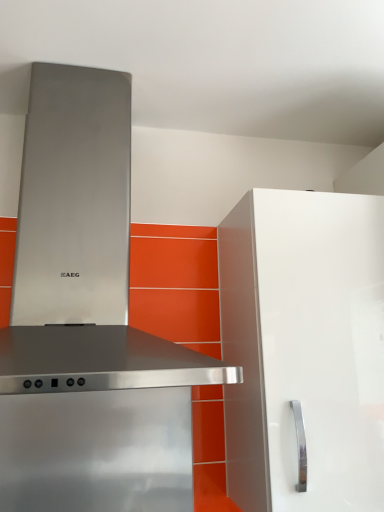
Question: Could you tell me if stainless steel range hood at upper left is facing white glossy cabinet at right?

Choices:
 (A) no
 (B) yes

Answer: (A)

Question: Is there a large distance between stainless steel range hood at upper left and white glossy cabinet at right?

Choices:
 (A) no
 (B) yes

Answer: (A)

Question: Is stainless steel range hood at upper left facing away from white glossy cabinet at right?

Choices:
 (A) no
 (B) yes

Answer: (A)

Question: Is the position of stainless steel range hood at upper left less distant than that of white glossy cabinet at right?

Choices:
 (A) no
 (B) yes

Answer: (B)

Question: Considering the relative sizes of stainless steel range hood at upper left and white glossy cabinet at right in the image provided, is stainless steel range hood at upper left shorter than white glossy cabinet at right?

Choices:
 (A) yes
 (B) no

Answer: (B)

Question: From a real-world perspective, is stainless steel range hood at upper left positioned over white glossy cabinet at right based on gravity?

Choices:
 (A) no
 (B) yes

Answer: (B)

Question: Considering the relative sizes of white glossy cabinet at right and stainless steel range hood at upper left in the image provided, is white glossy cabinet at right taller than stainless steel range hood at upper left?

Choices:
 (A) yes
 (B) no

Answer: (B)

Question: From a real-world perspective, is white glossy cabinet at right located higher than stainless steel range hood at upper left?

Choices:
 (A) no
 (B) yes

Answer: (A)

Question: Is white glossy cabinet at right outside of stainless steel range hood at upper left?

Choices:
 (A) yes
 (B) no

Answer: (A)

Question: Considering the relative sizes of white glossy cabinet at right and stainless steel range hood at upper left in the image provided, is white glossy cabinet at right smaller than stainless steel range hood at upper left?

Choices:
 (A) yes
 (B) no

Answer: (A)

Question: Does white glossy cabinet at right have a larger size compared to stainless steel range hood at upper left?

Choices:
 (A) no
 (B) yes

Answer: (A)

Question: Would you say white glossy cabinet at right is a long distance from stainless steel range hood at upper left?

Choices:
 (A) no
 (B) yes

Answer: (A)

Question: From a real-world perspective, is white glossy cabinet at right positioned above or below stainless steel range hood at upper left?

Choices:
 (A) above
 (B) below

Answer: (B)